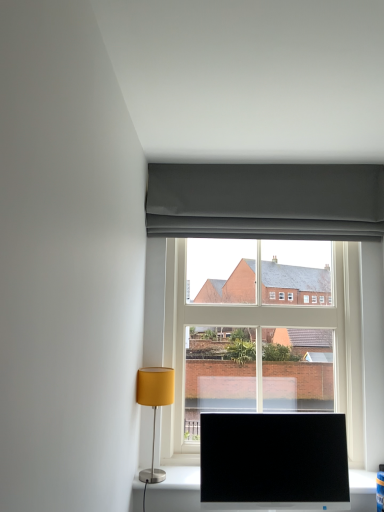
Question: Is matte yellow fabric lampshade at lower left facing away from clear glass window at center?

Choices:
 (A) yes
 (B) no

Answer: (B)

Question: From the image's perspective, is matte yellow fabric lampshade at lower left below clear glass window at center?

Choices:
 (A) yes
 (B) no

Answer: (A)

Question: From a real-world perspective, does matte yellow fabric lampshade at lower left stand above clear glass window at center?

Choices:
 (A) yes
 (B) no

Answer: (B)

Question: Is matte yellow fabric lampshade at lower left not inside clear glass window at center?

Choices:
 (A) yes
 (B) no

Answer: (A)

Question: Considering the relative sizes of matte yellow fabric lampshade at lower left and clear glass window at center in the image provided, is matte yellow fabric lampshade at lower left taller than clear glass window at center?

Choices:
 (A) no
 (B) yes

Answer: (A)

Question: Can you confirm if matte yellow fabric lampshade at lower left is wider than clear glass window at center?

Choices:
 (A) yes
 (B) no

Answer: (B)

Question: Is black glossy monitor at lower center smaller than matte yellow fabric lampshade at lower left?

Choices:
 (A) yes
 (B) no

Answer: (B)

Question: Considering the relative sizes of black glossy monitor at lower center and matte yellow fabric lampshade at lower left in the image provided, is black glossy monitor at lower center thinner than matte yellow fabric lampshade at lower left?

Choices:
 (A) yes
 (B) no

Answer: (A)

Question: From a real-world perspective, is black glossy monitor at lower center physically above matte yellow fabric lampshade at lower left?

Choices:
 (A) no
 (B) yes

Answer: (A)

Question: Can you confirm if black glossy monitor at lower center is positioned to the left of matte yellow fabric lampshade at lower left?

Choices:
 (A) no
 (B) yes

Answer: (A)

Question: Is black glossy monitor at lower center behind matte yellow fabric lampshade at lower left?

Choices:
 (A) yes
 (B) no

Answer: (B)

Question: Considering the relative sizes of black glossy monitor at lower center and matte yellow fabric lampshade at lower left in the image provided, is black glossy monitor at lower center wider than matte yellow fabric lampshade at lower left?

Choices:
 (A) yes
 (B) no

Answer: (B)

Question: From the image's perspective, does clear glass window at center appear higher than black glossy monitor at lower center?

Choices:
 (A) no
 (B) yes

Answer: (B)